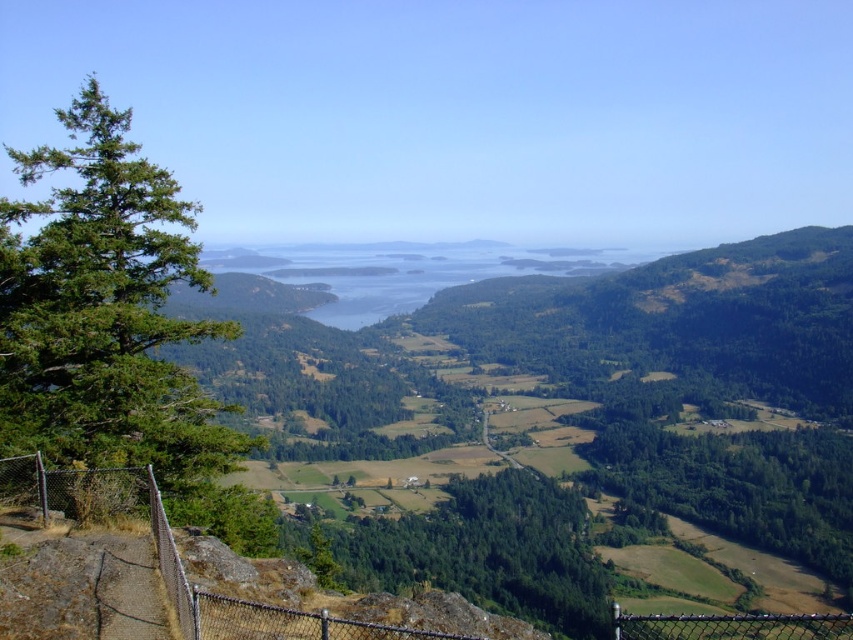
Question: Is rusty chain-link fence at lower center in front of chain link fence at lower right?

Choices:
 (A) no
 (B) yes

Answer: (B)

Question: Among these points, which one is nearest to the camera?

Choices:
 (A) (670, 627)
 (B) (376, 624)

Answer: (A)

Question: Does rusty chain-link fence at lower center have a smaller size compared to chain link fence at lower right?

Choices:
 (A) yes
 (B) no

Answer: (A)

Question: Which of the following is the farthest from the observer?

Choices:
 (A) (213, 600)
 (B) (834, 637)

Answer: (B)

Question: From the image, what is the correct spatial relationship of rusty chain-link fence at lower center in relation to chain link fence at lower right?

Choices:
 (A) right
 (B) left

Answer: (B)